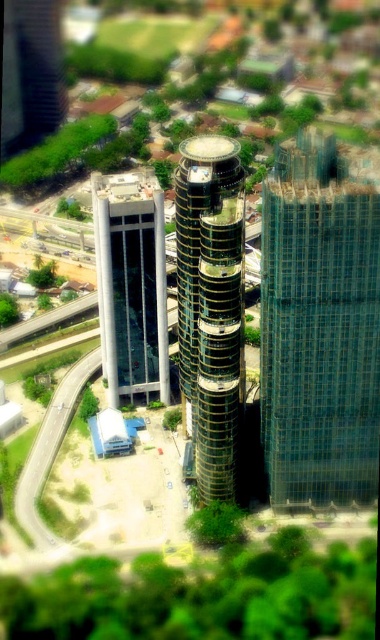
You are a city planner assessing building sizes for zoning compliance. Given the glassy black tower at center and the white concrete building at left, which one is smaller in height?

The glassy black tower at center is smaller than the white concrete building at left, so the glassy black tower at center is the smaller one.

You are a city planner reviewing the urban layout. You need to determine the placement of a new public park. Considering the transparent glass tower at right and the white concrete building at left, which building is closer to the east side of the city block?

The transparent glass tower at right is positioned on the right side of white concrete building at left, so the transparent glass tower at right is closer to the east side if the buildings are oriented with the white concrete building at left to the west.

You are an architect evaluating the urban layout. Given the transparent glass tower at right and the glassy black tower at center, which one is closer to the ground level?

The transparent glass tower at right is positioned under the glassy black tower at center, meaning it is closer to the ground level.